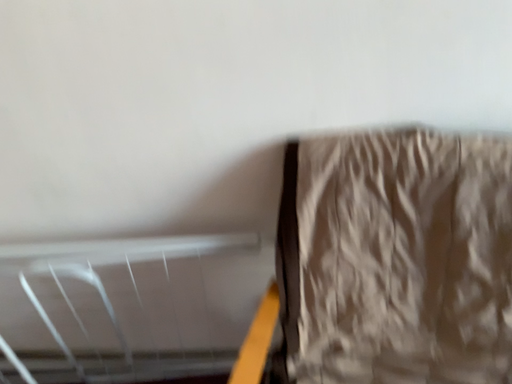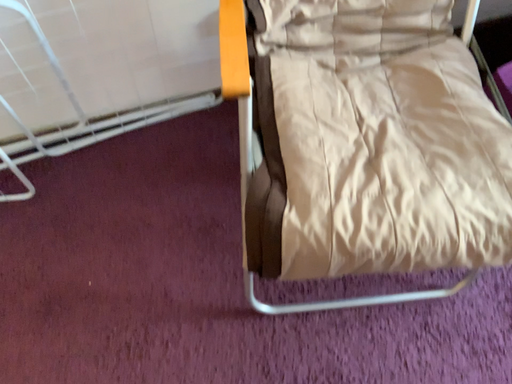
Question: Which way did the camera rotate in the video?

Choices:
 (A) rotated downward
 (B) rotated upward

Answer: (A)